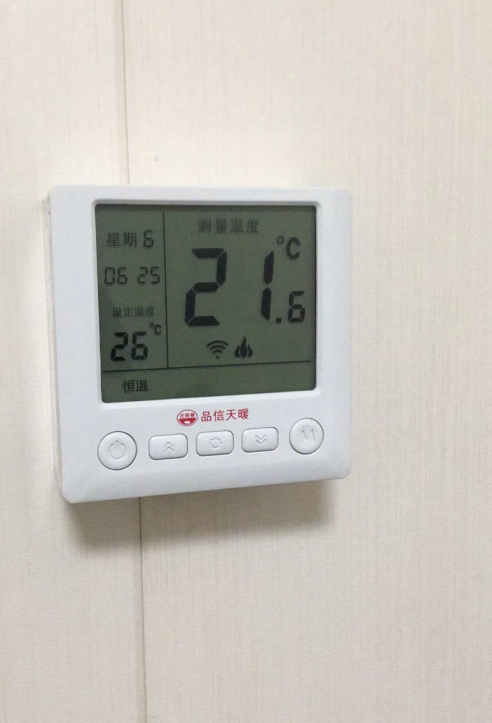
Where is `wall above thermostat`? The image size is (492, 723). wall above thermostat is located at coordinates (194, 176).